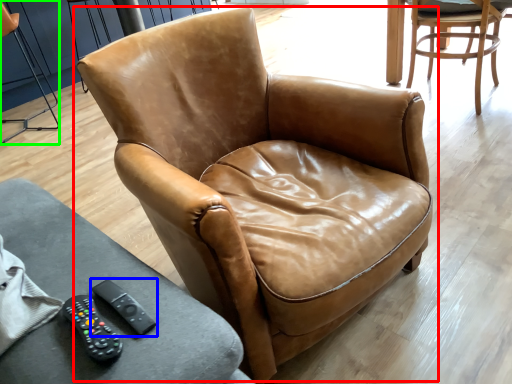
Question: Which is nearer to the chair (highlighted by a red box)? remote (highlighted by a blue box) or chair (highlighted by a green box).

Choices:
 (A) remote
 (B) chair

Answer: (A)